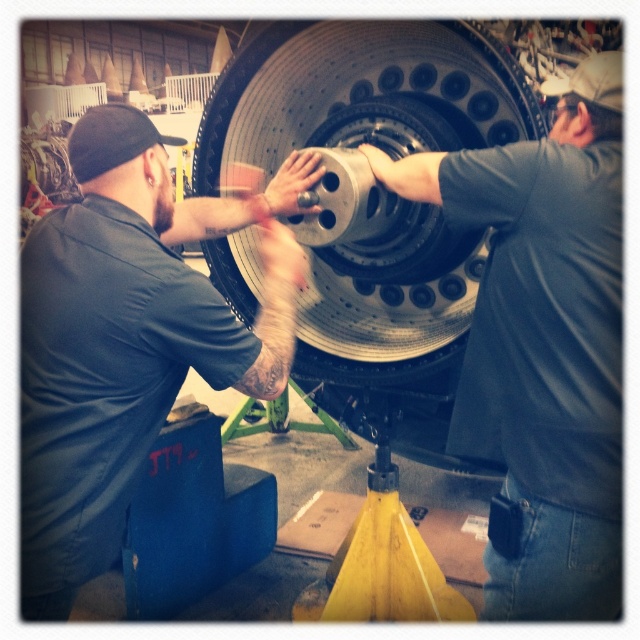
Can you confirm if matte black tire at center is positioned to the left of metallic silver tire at center?

No, matte black tire at center is not to the left of metallic silver tire at center.

Does point (531, 275) lie in front of point (317, 291)?

Yes, point (531, 275) is closer to viewer.

Where is `matte black tire at center`? The width and height of the screenshot is (640, 640). matte black tire at center is located at coordinates (544, 344).

Is matte black shirt at left shorter than matte black tire at center?

Yes, matte black shirt at left is shorter than matte black tire at center.

Which is behind, point (45, 392) or point (618, 184)?

Positioned behind is point (45, 392).

Locate an element on the screen. matte black shirt at left is located at coordinates tap(129, 337).

Which of these two, matte black shirt at left or metallic silver tire at center, stands shorter?

Standing shorter between the two is metallic silver tire at center.

Image resolution: width=640 pixels, height=640 pixels. Describe the element at coordinates (129, 337) in the screenshot. I see `matte black shirt at left` at that location.

Does point (29, 284) lie behind point (240, 88)?

No, it is not.

Where is `matte black shirt at left`? matte black shirt at left is located at coordinates (129, 337).